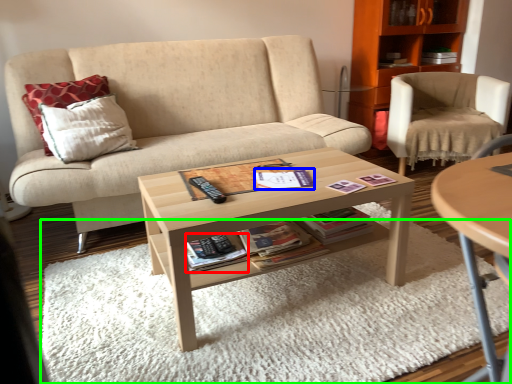
Question: Which object is the farthest from paperback book (highlighted by a red box)? Choose among these: book (highlighted by a blue box) or plain (highlighted by a green box).

Choices:
 (A) book
 (B) plain

Answer: (B)